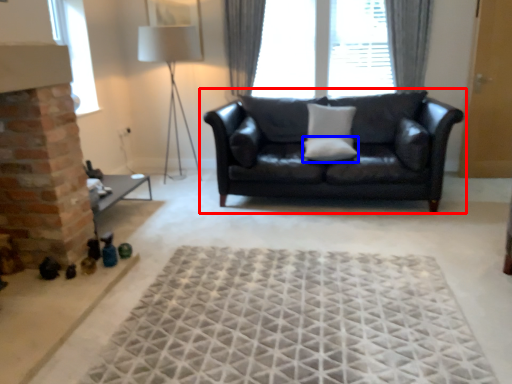
Question: Which of the following is the closest to the observer, studio couch (highlighted by a red box) or pillow (highlighted by a blue box)?

Choices:
 (A) studio couch
 (B) pillow

Answer: (A)